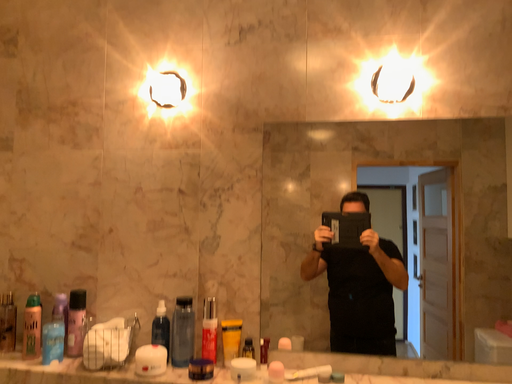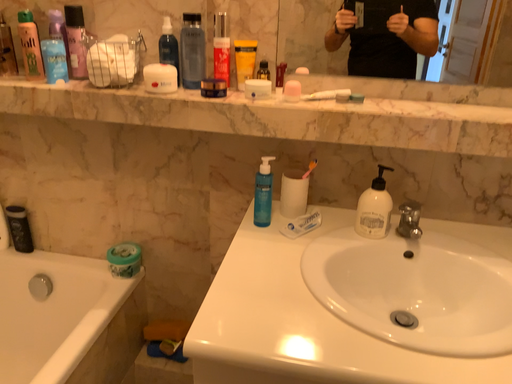
Question: Which way did the camera rotate in the video?

Choices:
 (A) rotated upward
 (B) rotated downward

Answer: (B)